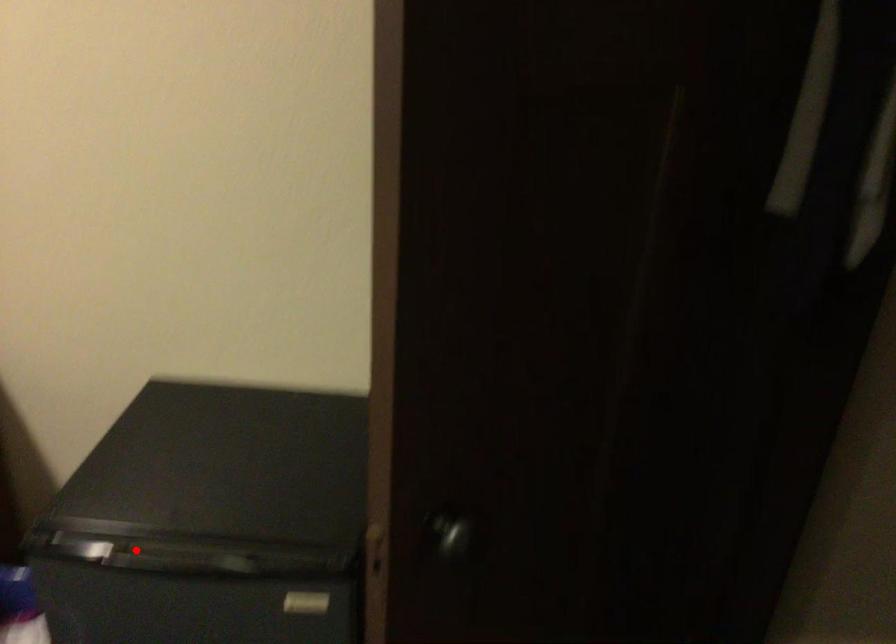
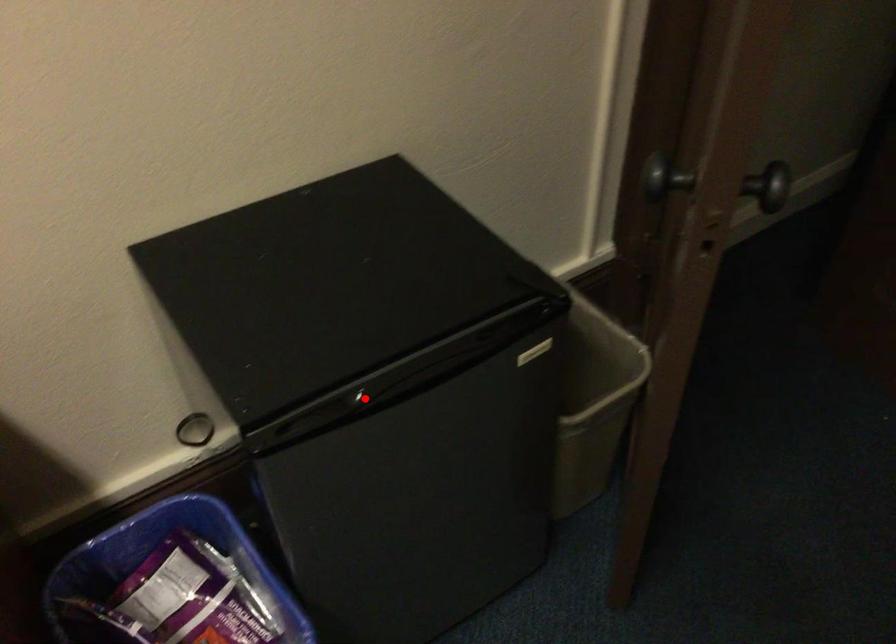
Based on the photo, I am providing you with two images of the same scene from different viewpoints. A red point is marked on the first image and another point is marked on the second image. Is the marked point in image1 the same physical position as the marked point in image2?

Yes